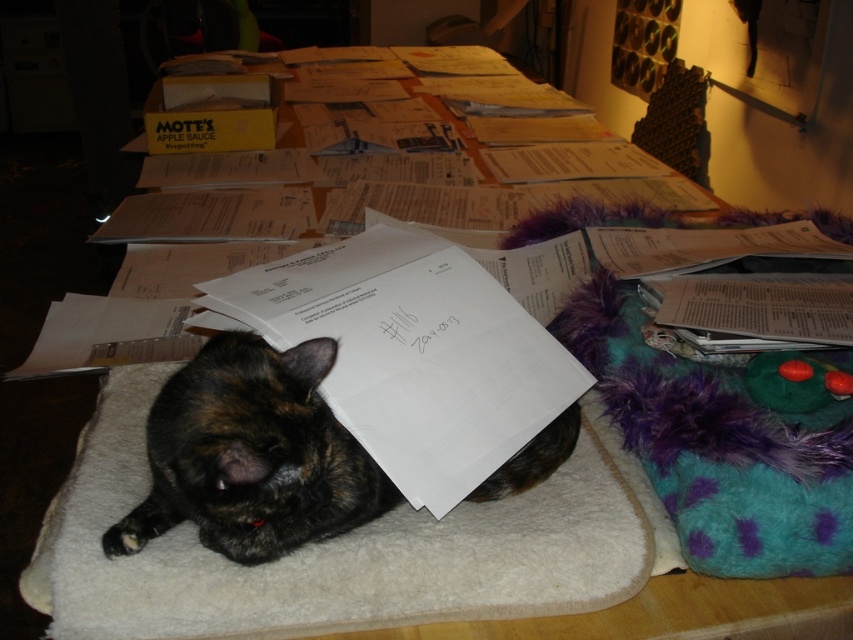
Question: Does white paper at center appear over tortoiseshell fur cat at center?

Choices:
 (A) yes
 (B) no

Answer: (A)

Question: Which point is closer to the camera?

Choices:
 (A) tortoiseshell fur cat at center
 (B) white paper at center

Answer: (A)

Question: Is white paper at center smaller than tortoiseshell fur cat at center?

Choices:
 (A) no
 (B) yes

Answer: (A)

Question: Which object appears closest to the camera in this image?

Choices:
 (A) tortoiseshell fur cat at center
 (B) white paper at center

Answer: (A)

Question: Among these points, which one is nearest to the camera?

Choices:
 (A) (117, 548)
 (B) (483, 451)

Answer: (A)

Question: Is white paper at center further to the viewer compared to tortoiseshell fur cat at center?

Choices:
 (A) yes
 (B) no

Answer: (A)